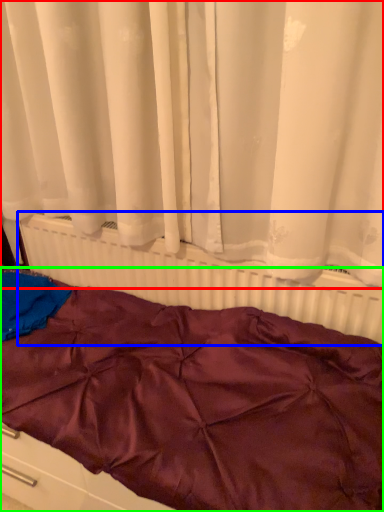
Question: Estimate the real-world distances between objects in this image. Which object is closer to curtain (highlighted by a red box), radiator (highlighted by a blue box) or furniture (highlighted by a green box)?

Choices:
 (A) radiator
 (B) furniture

Answer: (A)